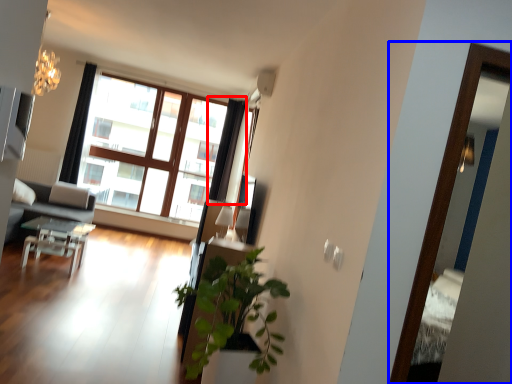
Question: Which object is further to the camera taking this photo, curtain (highlighted by a red box) or screen door (highlighted by a blue box)?

Choices:
 (A) curtain
 (B) screen door

Answer: (A)